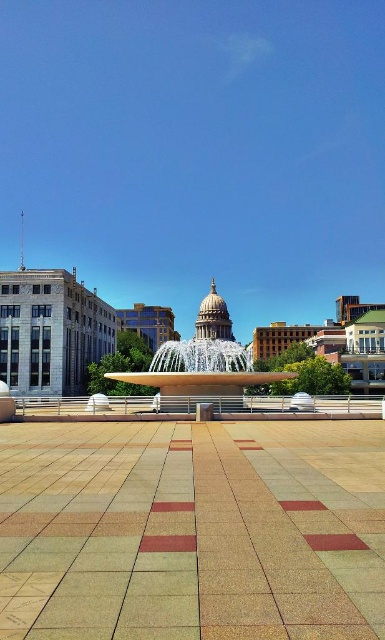
Question: Among these objects, which one is nearest to the camera?

Choices:
 (A) white glossy fountain at center
 (B) brown textured tiles at center

Answer: (B)

Question: Among these points, which one is farthest from the camera?

Choices:
 (A) (68, 426)
 (B) (239, 371)

Answer: (B)

Question: Does brown textured tiles at center come behind white glossy fountain at center?

Choices:
 (A) yes
 (B) no

Answer: (B)

Question: Observing the image, what is the correct spatial positioning of brown textured tiles at center in reference to white glossy fountain at center?

Choices:
 (A) left
 (B) right

Answer: (A)

Question: Is brown textured tiles at center bigger than white glossy fountain at center?

Choices:
 (A) yes
 (B) no

Answer: (B)